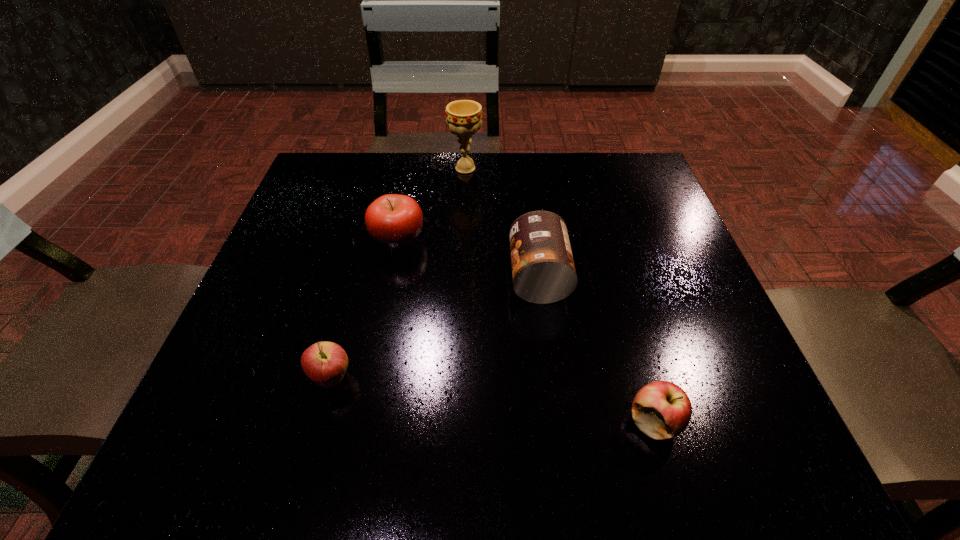
Where is `vacant space at the near edge of the desktop`? This screenshot has width=960, height=540. vacant space at the near edge of the desktop is located at coordinates (473, 449).

Find the location of `vacant space at the left edge`. vacant space at the left edge is located at coordinates (267, 349).

The width and height of the screenshot is (960, 540). I want to click on blank space at the right edge, so click(x=645, y=296).

In the image, there is a desktop. At what (x,y) coordinates should I click in order to perform the action: click on vacant space at the far left corner. Please return your answer as a coordinate pair (x, y). Looking at the image, I should click on (316, 176).

Image resolution: width=960 pixels, height=540 pixels. In order to click on vacant space at the near left corner of the desktop in this screenshot , I will do `click(230, 443)`.

What are the coordinates of `vacant point at the far right corner` in the screenshot? It's located at (640, 198).

This screenshot has width=960, height=540. Identify the location of vacant area that lies between the nearest apple and the second farthest apple. (492, 401).

Identify the location of vacant space that's between the farthest apple and the second object from right to left. (468, 258).

At what (x,y) coordinates should I click in order to perform the action: click on free space between the shortest object and the second farthest apple. Please return your answer as a coordinate pair (x, y). Looking at the image, I should click on (492, 401).

Where is `blank region between the second nearest object and the second object from right to left`? This screenshot has height=540, width=960. blank region between the second nearest object and the second object from right to left is located at coordinates (435, 328).